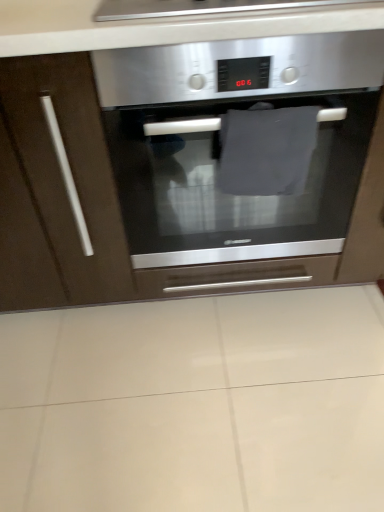
The width and height of the screenshot is (384, 512). Describe the element at coordinates (188, 147) in the screenshot. I see `matte brown cabinet at center` at that location.

Measure the distance between matte brown cabinet at center and camera.

matte brown cabinet at center is 30.16 inches away from camera.

I want to click on matte brown cabinet at center, so click(x=188, y=147).

Where is `matte brown cabinet at center`? matte brown cabinet at center is located at coordinates (188, 147).